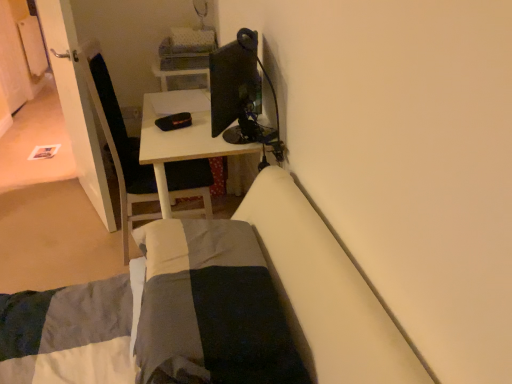
Question: Considering the positions of white glossy door at left and dark gray cotton blanket at lower center in the image, is white glossy door at left bigger or smaller than dark gray cotton blanket at lower center?

Choices:
 (A) small
 (B) big

Answer: (B)

Question: In terms of width, does white glossy door at left look wider or thinner when compared to dark gray cotton blanket at lower center?

Choices:
 (A) wide
 (B) thin

Answer: (B)

Question: Which is farther from the dark gray cotton blanket at lower center?

Choices:
 (A) white glossy desk at center
 (B) matte black monitor at upper center
 (C) white glossy door at left

Answer: (C)

Question: Which object is positioned farthest from the white glossy door at left?

Choices:
 (A) matte black monitor at upper center
 (B) dark gray cotton blanket at lower center
 (C) white glossy desk at center

Answer: (B)